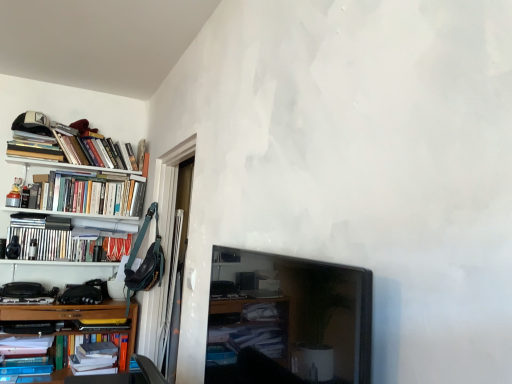
Question: Is there a large distance between hardcover books at left, marked as the 5th book in a top-to-bottom arrangement, and hardcover books at left, which appears as the fourth book when ordered from the bottom?

Choices:
 (A) yes
 (B) no

Answer: (B)

Question: Does hardcover books at left, marked as the 5th book in a top-to-bottom arrangement, turn towards hardcover books at left, which is the fourth book from top to bottom?

Choices:
 (A) yes
 (B) no

Answer: (B)

Question: Can you confirm if hardcover books at left, which is the 3th book from bottom to top, is taller than hardcover books at left, which is the fourth book from top to bottom?

Choices:
 (A) yes
 (B) no

Answer: (A)

Question: Is hardcover books at left, which appears as the fourth book when ordered from the bottom, inside hardcover books at left, which is the 3th book from bottom to top?

Choices:
 (A) no
 (B) yes

Answer: (A)

Question: Is hardcover books at left, marked as the 5th book in a top-to-bottom arrangement, outside hardcover books at left, which is the fourth book from top to bottom?

Choices:
 (A) no
 (B) yes

Answer: (B)

Question: Considering the relative sizes of hardcover books at left, which is the 3th book from bottom to top, and hardcover books at left, which appears as the fourth book when ordered from the bottom, in the image provided, is hardcover books at left, which is the 3th book from bottom to top, shorter than hardcover books at left, which appears as the fourth book when ordered from the bottom,?

Choices:
 (A) yes
 (B) no

Answer: (B)

Question: Considering the relative sizes of hardcover book at lower left, arranged as the second book when ordered from the bottom, and hardcover books at left, the third book in the top-to-bottom sequence, in the image provided, is hardcover book at lower left, arranged as the second book when ordered from the bottom, bigger than hardcover books at left, the third book in the top-to-bottom sequence,?

Choices:
 (A) yes
 (B) no

Answer: (B)

Question: From a real-world perspective, is hardcover book at lower left, acting as the sixth book starting from the top, on hardcover books at left, the third book in the top-to-bottom sequence?

Choices:
 (A) no
 (B) yes

Answer: (A)

Question: Considering the relative sizes of hardcover book at lower left, arranged as the second book when ordered from the bottom, and hardcover books at left, the third book in the top-to-bottom sequence, in the image provided, is hardcover book at lower left, arranged as the second book when ordered from the bottom, wider than hardcover books at left, the third book in the top-to-bottom sequence,?

Choices:
 (A) no
 (B) yes

Answer: (B)

Question: From the image's perspective, is hardcover book at lower left, acting as the sixth book starting from the top, located above hardcover books at left, which is counted as the fifth book, starting from the bottom?

Choices:
 (A) yes
 (B) no

Answer: (B)

Question: Does hardcover book at lower left, arranged as the second book when ordered from the bottom, contain hardcover books at left, which is counted as the fifth book, starting from the bottom?

Choices:
 (A) yes
 (B) no

Answer: (B)

Question: Is hardcover book at lower left, acting as the sixth book starting from the top, facing away from hardcover books at left, the third book in the top-to-bottom sequence?

Choices:
 (A) yes
 (B) no

Answer: (B)

Question: From a real-world perspective, is hardcover books at upper left, marked as the 2th book in a top-to-bottom arrangement, located higher than hardcover books at left, the first book in the top-to-bottom sequence?

Choices:
 (A) no
 (B) yes

Answer: (B)